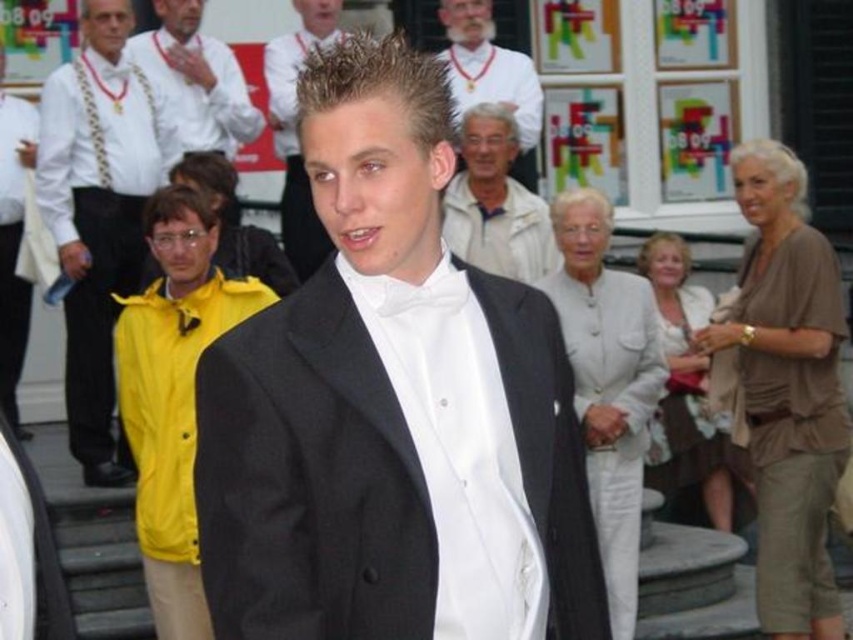
You are a photographer standing at the center of the event. You need to adjust your camera focus to capture the white satin bow tie at upper center. According to the coordinates provided, where should you aim your camera?

The white satin bow tie at upper center is located at coordinates point (198,77), so you should aim your camera at that specific point to capture it.

You are at an event and need to locate the central figure wearing a black suit. Using the coordinate system where the bottom left corner is the origin, can you determine if the point at coordinates (392, 406) is closer to the central figure or the background individuals?

The point at coordinates (392, 406) corresponds to the black satin tuxedo at center, so it is closer to the central figure.

You are standing at the point with coordinates point (219, 230) and want to walk to the point with coordinates point (233, 104). Is the point you want to reach located behind you or in front of you?

The point (233, 104) is behind point (219, 230), so the point you want to reach is behind you.